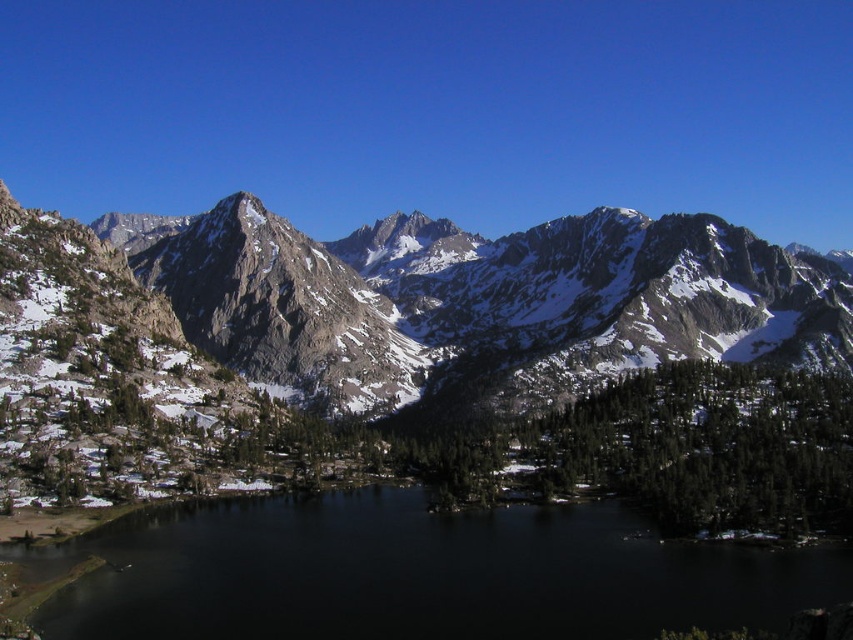
You are planning a hiking trip and want to know which object in the scene is taller. You see the rocky gray mountain range at center and the black water at center. Which one is taller?

The rocky gray mountain range at center is much taller than the black water at center.

You are standing at the edge of the black water at center and want to reach the rocky gray mountain range at center. Which direction should you head towards?

The rocky gray mountain range at center is positioned on the left side of black water at center, so you should head towards the left to reach it.

You are a photographer positioned at the origin point of the image. You want to capture the rocky gray mountain range at center in your shot. What are the coordinates where you should aim your camera?

The coordinates for the rocky gray mountain range at center are at point (434, 300), so you should aim your camera at those coordinates to capture it.